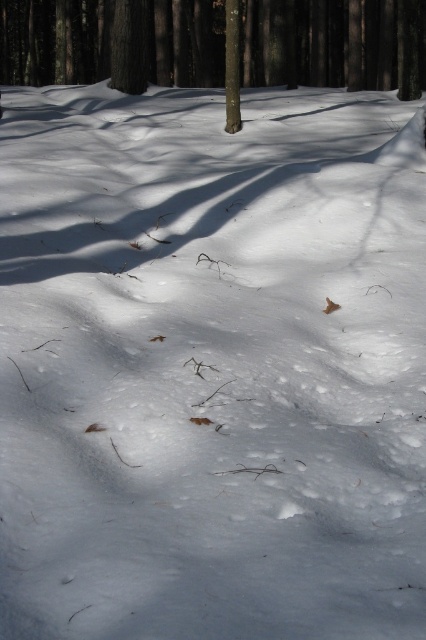
Can you confirm if brown rough tree at center is taller than smooth brown tree trunk at center?

Yes.

Does point (278, 32) lie behind point (233, 100)?

Yes, it is behind point (233, 100).

What are the coordinates of `brown rough tree at center` in the screenshot? It's located at (215, 44).

The image size is (426, 640). In order to click on brown rough tree at center in this screenshot , I will do `click(215, 44)`.